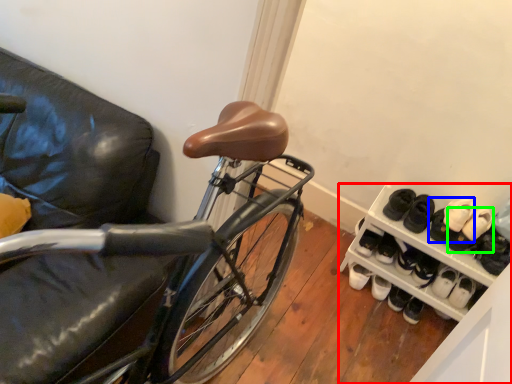
Question: Considering the real-world distances, which object is closest to cabinetry (highlighted by a red box)? footwear (highlighted by a blue box) or footwear (highlighted by a green box).

Choices:
 (A) footwear
 (B) footwear

Answer: (A)